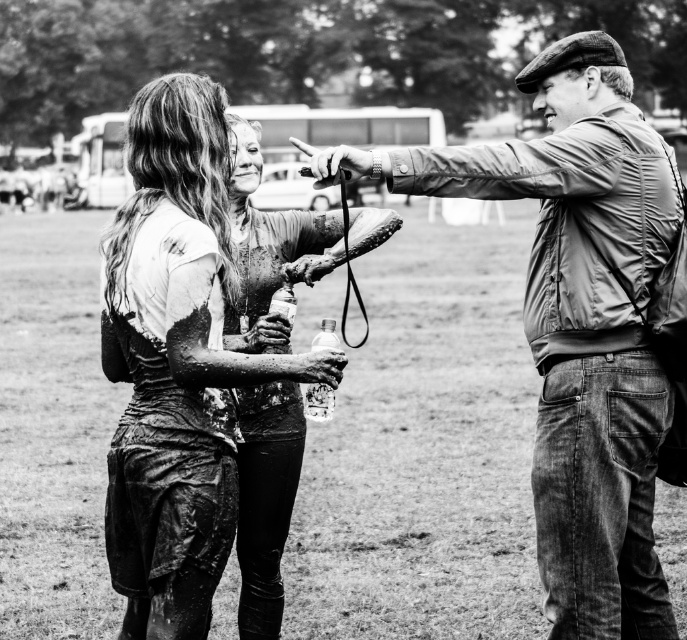
Question: Is leather jacket at right above muddy leather jacket at center?

Choices:
 (A) no
 (B) yes

Answer: (B)

Question: Estimate the real-world distances between objects in this image. Which object is farther from the leather jacket at right?

Choices:
 (A) dirty leather jacket at center
 (B) muddy leather jacket at center

Answer: (B)

Question: Which object is closer to the camera taking this photo?

Choices:
 (A) muddy leather jacket at center
 (B) leather jacket at right
 (C) dirty leather jacket at center

Answer: (B)

Question: Which of these objects is positioned farthest from the dirty leather jacket at center?

Choices:
 (A) muddy leather jacket at center
 (B) leather jacket at right

Answer: (A)

Question: Is leather jacket at right closer to the viewer compared to muddy leather jacket at center?

Choices:
 (A) yes
 (B) no

Answer: (A)

Question: Is leather jacket at right closer to the viewer compared to muddy leather jacket at center?

Choices:
 (A) no
 (B) yes

Answer: (B)